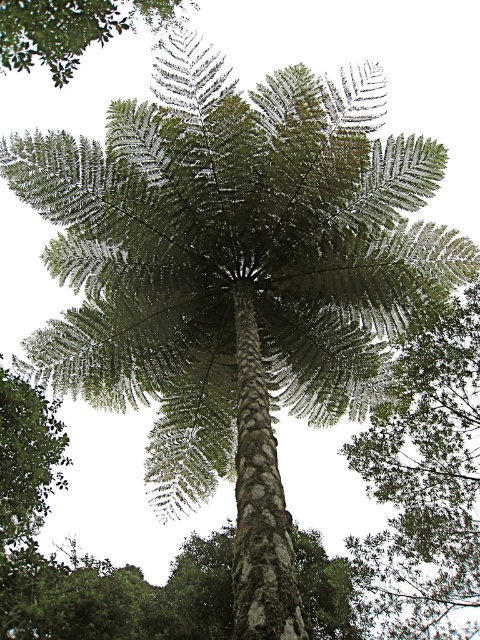
Between green leafy tree at center and green leafy tree at upper left, which one has more height?

Standing taller between the two is green leafy tree at upper left.

Does point (453, 404) come farther from viewer compared to point (162, 24)?

No, (453, 404) is closer to viewer.

At what (x,y) coordinates should I click in order to perform the action: click on green leafy tree at center. Please return your answer as a coordinate pair (x, y). Looking at the image, I should click on (424, 481).